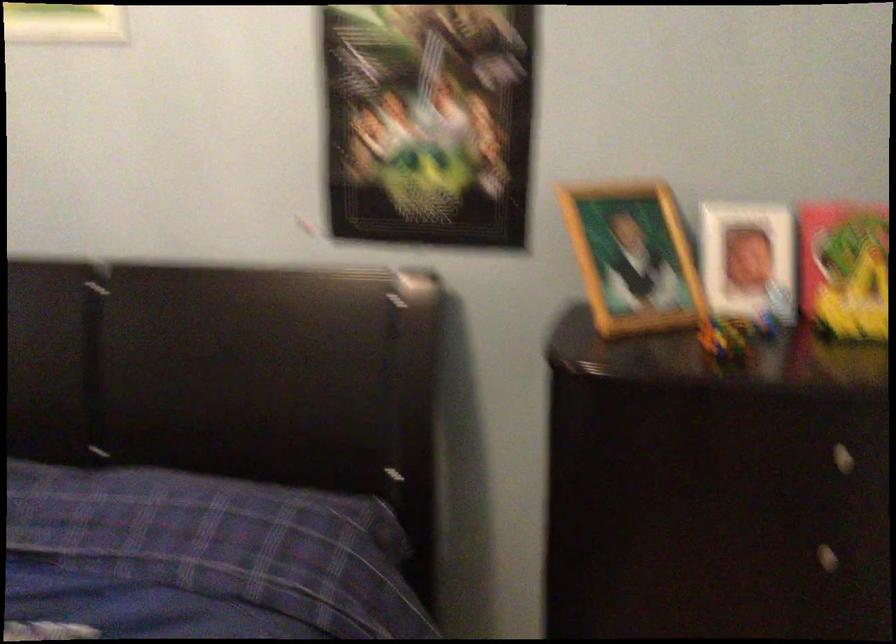
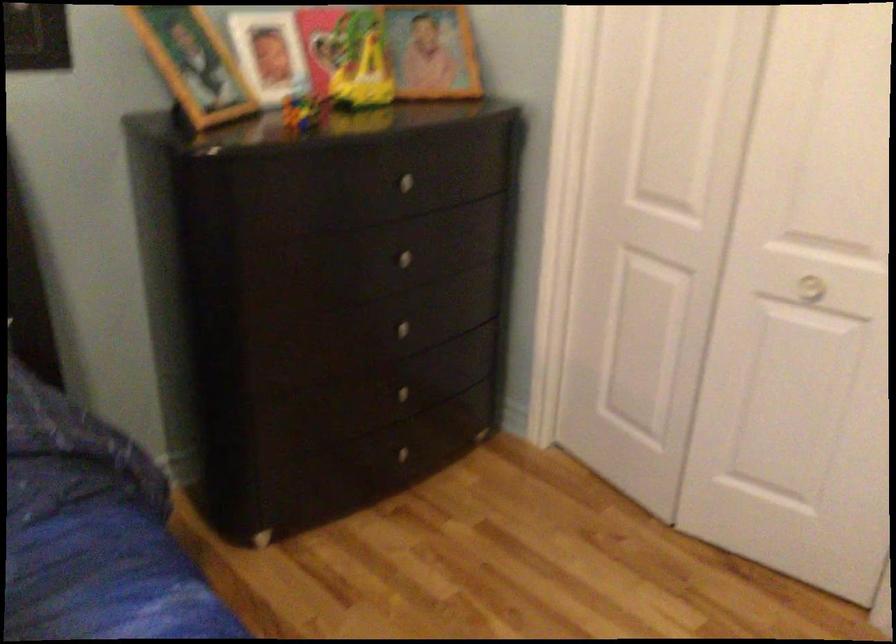
Find the pixel in the second image that matches (812,547) in the first image.

(399, 258)